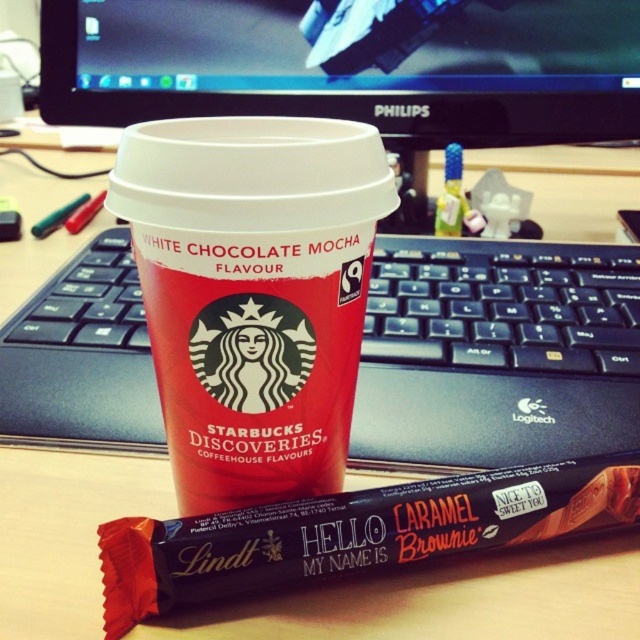
What object is located at the coordinates point (x=497, y=353)?

The black plastic keyboard at center is located at point (x=497, y=353).

Consider the image. You are organizing your desk and need to place the black plastic keyboard at center. Where exactly should you position it according to the coordinates provided?

The black plastic keyboard at center should be positioned at coordinates point (497, 353) as specified.